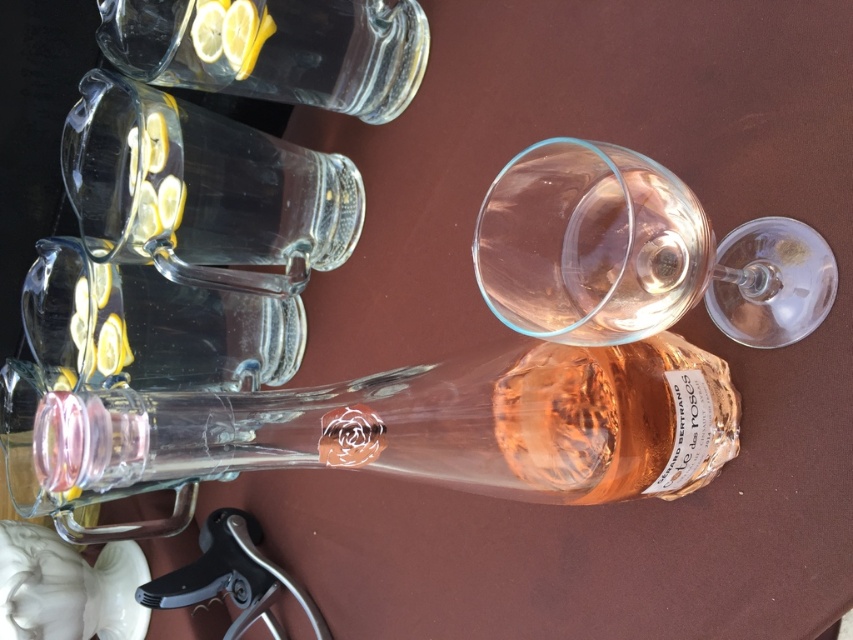
Question: Which of the following is the closest to the observer?

Choices:
 (A) (631, 362)
 (B) (762, 301)
 (C) (305, 196)
 (D) (305, 51)

Answer: (A)

Question: Does clear glass bottle at center have a greater width compared to clear glass carafe at upper left?

Choices:
 (A) yes
 (B) no

Answer: (A)

Question: Is transparent glass wine glass at center closer to camera compared to transparent glass carafe at upper left?

Choices:
 (A) no
 (B) yes

Answer: (B)

Question: Which object is positioned farthest from the clear glass bottle at center?

Choices:
 (A) transparent glass wine glass at center
 (B) transparent glass carafe at upper left

Answer: (B)

Question: Does clear glass bottle at center appear over transparent glass carafe at upper left?

Choices:
 (A) yes
 (B) no

Answer: (B)

Question: Which point is farther from the camera taking this photo?

Choices:
 (A) [x=341, y=246]
 (B) [x=376, y=99]
 (C) [x=498, y=221]
 (D) [x=477, y=449]

Answer: (A)